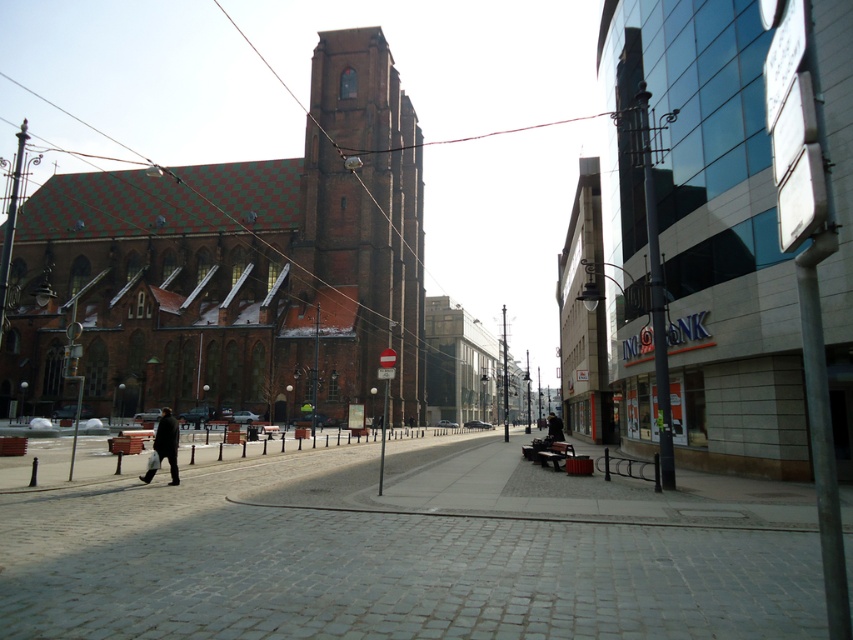
You are a tourist standing on the cobblestone street and want to take a photo of the brown brick church at left and the black leather jacket at center. Which object should you focus on first if you want to capture both in a single frame without moving the camera?

You should focus on the brown brick church at left first because it is larger in size than the black leather jacket at center, allowing it to be more prominent in the frame while still including the smaller object.

You are a tourist standing on the cobblestone street and want to take a photo of the brown brick church at left and the black leather jacket at center. Which object should you focus on first if you want to capture both in a single frame without moving the camera?

You should focus on the brown brick church at left first because it is wider than the black leather jacket at center, ensuring it fits within the frame.